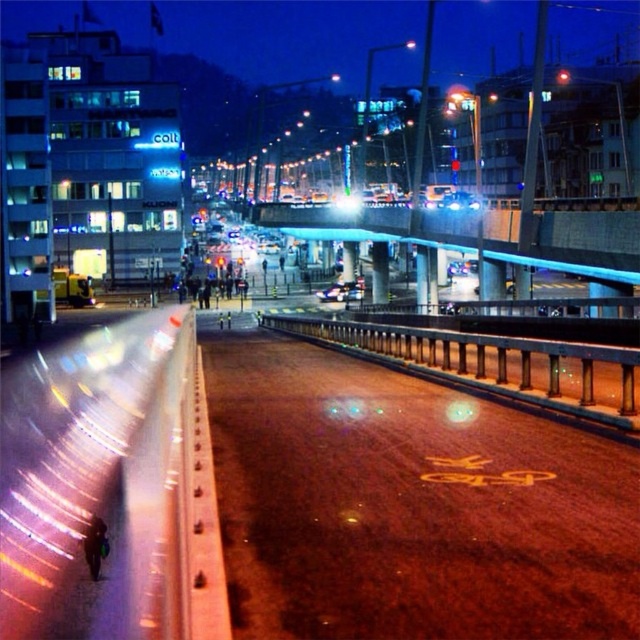
You are standing at the edge of the road in the image. Where is the yellow asphalt at center located in terms of its 2D coordinates?

The yellow asphalt at center is located at the 2D coordinates of point (x=408, y=502).

You are a city planner analyzing the urban layout. The scene shows a road with a bicycle lane and a building with commercial signs. There is also a point marked at coordinates (476, 232). What does this point represent?

The point at coordinates (476, 232) indicates the location of the blue glass bridge at center.

You are a delivery person needing to cross the blue glass bridge at center to deliver a package. Your metallic silver car at center has a trunk that can only open fully if there is at least 12 meters of clearance in front of it. Is there enough space for the trunk to open fully?

The distance between the blue glass bridge at center and the metallic silver car at center is 11.43 meters, which is less than the required 12 meters. Therefore, the trunk cannot open fully.